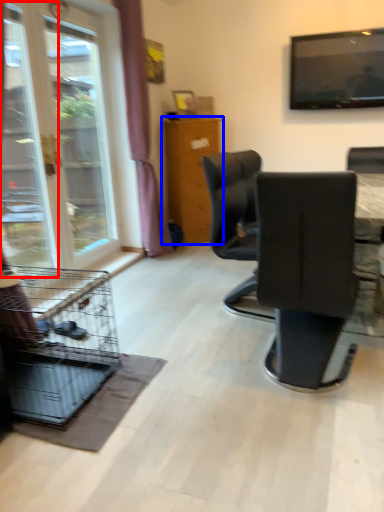
Question: Which object appears farthest to the camera in this image, screen door (highlighted by a red box) or furniture (highlighted by a blue box)?

Choices:
 (A) screen door
 (B) furniture

Answer: (B)